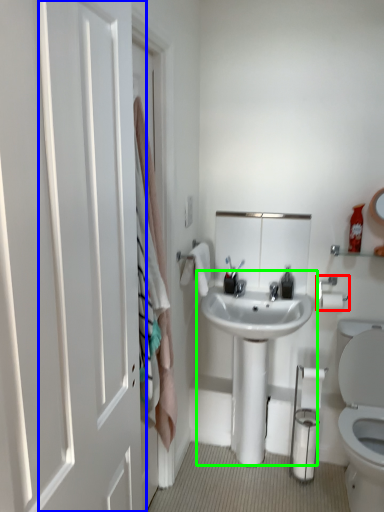
Question: Which object is positioned closest to towel bar (highlighted by a red box)? Select from door (highlighted by a blue box) and sink (highlighted by a green box).

Choices:
 (A) door
 (B) sink

Answer: (B)